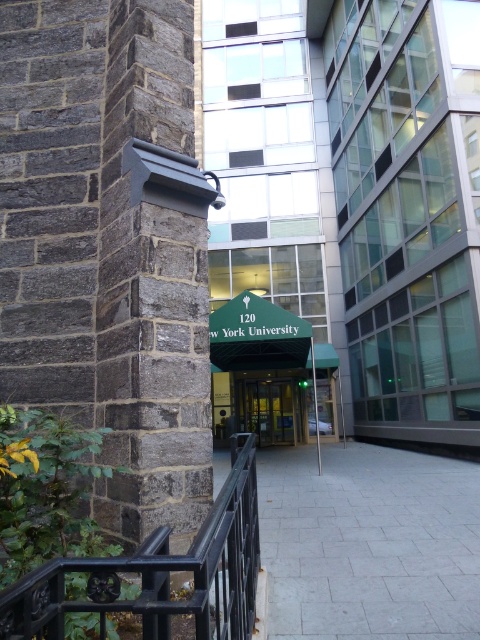
Is gray stone pavement at center shorter than green fabric entrance at center?

Yes.

This screenshot has width=480, height=640. Identify the location of gray stone pavement at center. click(x=369, y=544).

Identify the location of gray stone pavement at center. click(x=369, y=544).

Who is shorter, dark gray stone pillar at left or green fabric entrance at center?

green fabric entrance at center

Identify the location of dark gray stone pillar at left. (152, 280).

The width and height of the screenshot is (480, 640). In order to click on dark gray stone pillar at left in this screenshot , I will do `click(152, 280)`.

The height and width of the screenshot is (640, 480). I want to click on dark gray stone pillar at left, so click(x=152, y=280).

Does dark gray stone pillar at left appear on the left side of gray stone pavement at center?

Yes, dark gray stone pillar at left is to the left of gray stone pavement at center.

Can you confirm if dark gray stone pillar at left is wider than gray stone pavement at center?

No, dark gray stone pillar at left is not wider than gray stone pavement at center.

Which is behind, point (99, 324) or point (360, 588)?

The point (99, 324) is behind.

You are a GUI agent. You are given a task and a screenshot of the screen. Output one action in this format:
    pyautogui.click(x=<x>, y=<y>)
    Task: Click on the dark gray stone pillar at left
    The image size is (480, 640).
    Given the screenshot: What is the action you would take?
    pyautogui.click(x=152, y=280)